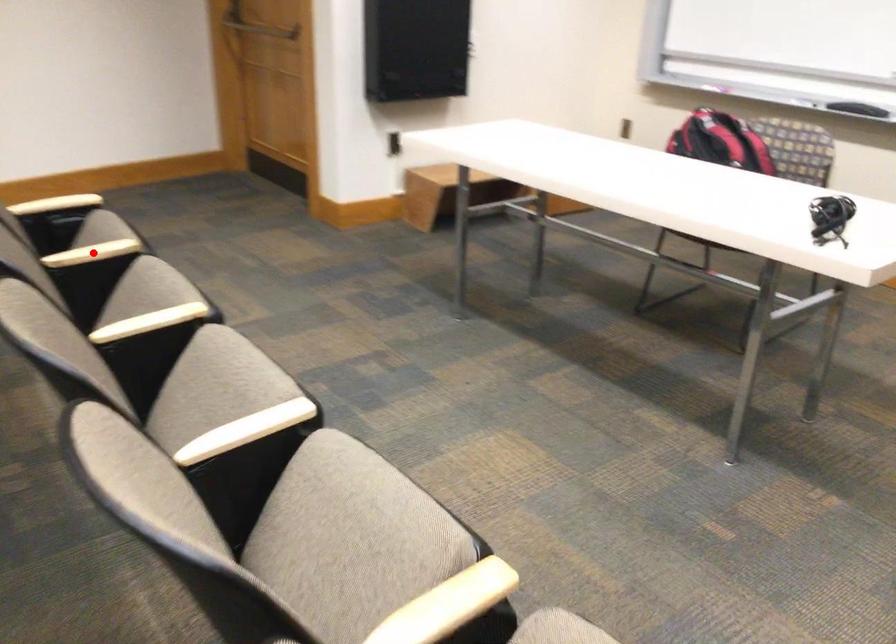
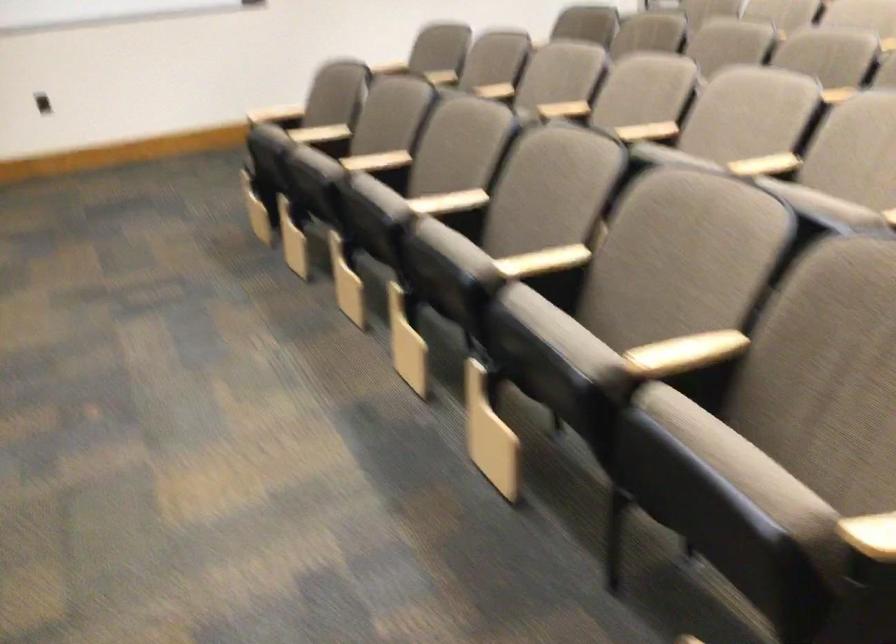
Question: I am providing you with two images of the same scene from different viewpoints. A red point is marked on the first image. Can you still see the location of the red point in image 2?

Choices:
 (A) Yes
 (B) No

Answer: (B)